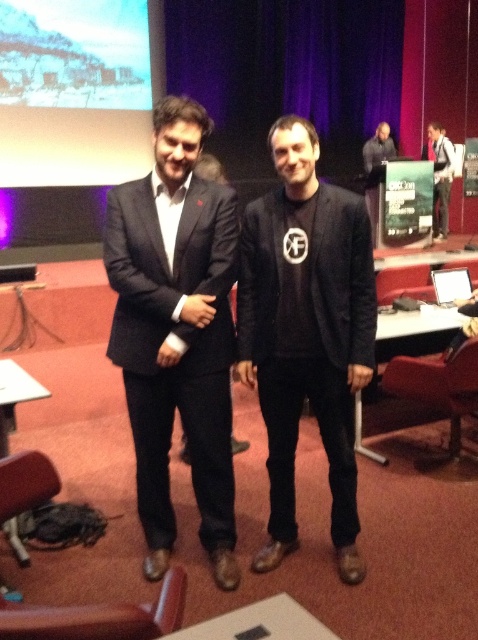
Question: Observing the image, what is the correct spatial positioning of black matte suit at center in reference to matte white screen at upper left?

Choices:
 (A) below
 (B) above

Answer: (A)

Question: Estimate the real-world distances between objects in this image. Which object is farther from the matte white screen at upper left?

Choices:
 (A) dark gray suit at right
 (B) dark gray hoodie at upper right
 (C) black matte jacket at center
 (D) matte black suit at center

Answer: (C)

Question: Is the position of black matte suit at center less distant than that of matte white screen at upper left?

Choices:
 (A) no
 (B) yes

Answer: (B)

Question: Estimate the real-world distances between objects in this image. Which object is closer to the black matte suit at center?

Choices:
 (A) matte black suit at center
 (B) black matte jacket at center
 (C) dark gray hoodie at upper right
 (D) matte white screen at upper left

Answer: (B)

Question: Can you confirm if dark gray suit at right is wider than dark gray hoodie at upper right?

Choices:
 (A) yes
 (B) no

Answer: (B)

Question: Among these points, which one is farthest from the camera?

Choices:
 (A) (23, 29)
 (B) (229, 392)
 (C) (375, 147)
 (D) (445, 232)

Answer: (C)